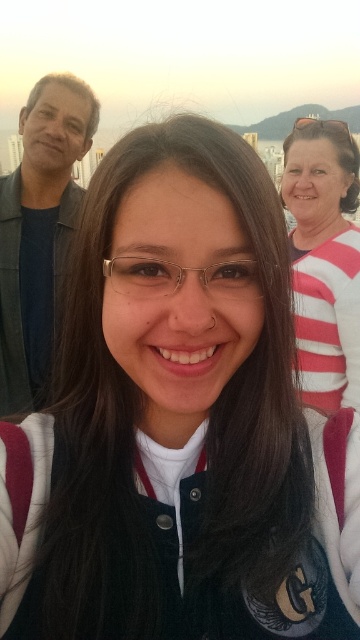
Based on the photo, you are standing in the scene and want to move from the point at coordinates point (x=24, y=230) to the point at coordinates point (x=123, y=268). Which direction should you move to get closer to your destination?

To move from point (x=24, y=230) to point (x=123, y=268), you should move upwards and to the right because point (x=24, y=230) is behind point (x=123, y=268) in the scene.

From the picture: You are a photographer trying to adjust the focus of your camera. You want to ensure that both the matte black jacket at left and the clear plastic glasses at center are in focus. Considering their sizes, which object should you prioritize focusing on first?

The matte black jacket at left has a larger size compared to the clear plastic glasses at center, so you should prioritize focusing on the matte black jacket at left first to ensure it is sharp.